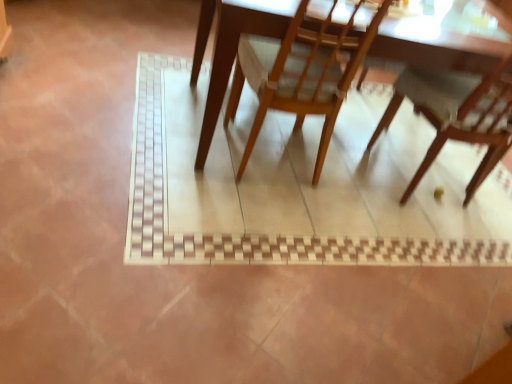
Question: From a real-world perspective, relative to wooden chair at lower right, acting as the first chair starting from the right, is wooden table at center vertically above or below?

Choices:
 (A) above
 (B) below

Answer: (B)

Question: Is wooden table at center taller or shorter than wooden chair at lower right, which is the second chair from left to right?

Choices:
 (A) tall
 (B) short

Answer: (B)

Question: Which of these objects is positioned closest to the wooden chair at lower right, which is the second chair from left to right?

Choices:
 (A) wooden table at center
 (B) wooden chair at center, which ranks as the 2th chair in right-to-left order

Answer: (B)

Question: Based on their relative distances, which object is nearer to the wooden chair at center, which ranks as the 2th chair in right-to-left order?

Choices:
 (A) wooden table at center
 (B) wooden chair at lower right, which is the second chair from left to right

Answer: (A)